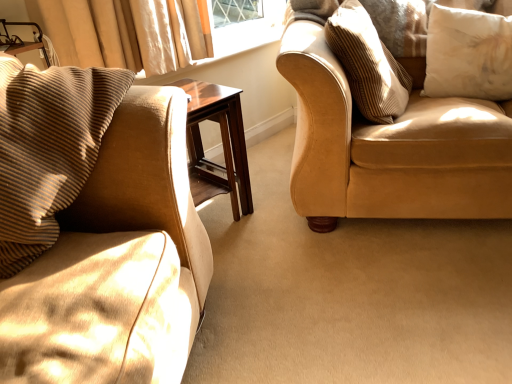
Question: Is striped fabric pillow at upper right, acting as the 2th pillow starting from the right, taller than white soft cushion at upper right, the first pillow from the right?

Choices:
 (A) yes
 (B) no

Answer: (A)

Question: Is striped fabric pillow at upper right, acting as the 2th pillow starting from the right, facing towards white soft cushion at upper right, the first pillow from the right?

Choices:
 (A) yes
 (B) no

Answer: (A)

Question: Does striped fabric pillow at upper right, acting as the 2th pillow starting from the right, appear on the left side of white soft cushion at upper right, which ranks as the third pillow in left-to-right order?

Choices:
 (A) yes
 (B) no

Answer: (A)

Question: From a real-world perspective, is striped fabric pillow at upper right, acting as the 2th pillow starting from the right, located beneath white soft cushion at upper right, the first pillow from the right?

Choices:
 (A) no
 (B) yes

Answer: (A)

Question: Is striped fabric pillow at upper right, acting as the 2th pillow starting from the right, beside white soft cushion at upper right, the first pillow from the right?

Choices:
 (A) no
 (B) yes

Answer: (A)

Question: Based on their sizes in the image, would you say white soft cushion at upper right, the first pillow from the right, is bigger or smaller than brown corduroy pillow at left, positioned as the third pillow in right-to-left order?

Choices:
 (A) big
 (B) small

Answer: (B)

Question: Would you say white soft cushion at upper right, the first pillow from the right, is inside or outside brown corduroy pillow at left, which is the 1th pillow from left to right?

Choices:
 (A) outside
 (B) inside

Answer: (A)

Question: Is white soft cushion at upper right, which ranks as the third pillow in left-to-right order, taller or shorter than brown corduroy pillow at left, which is the 1th pillow from left to right?

Choices:
 (A) tall
 (B) short

Answer: (B)

Question: Is point (473, 64) positioned closer to the camera than point (9, 238)?

Choices:
 (A) closer
 (B) farther

Answer: (B)

Question: From a real-world perspective, is brown corduroy pillow at left, positioned as the third pillow in right-to-left order, physically located above or below mahogany wood side table at center?

Choices:
 (A) below
 (B) above

Answer: (B)

Question: Is point (17, 155) positioned closer to the camera than point (233, 218)?

Choices:
 (A) farther
 (B) closer

Answer: (B)

Question: Considering the positions of brown corduroy pillow at left, positioned as the third pillow in right-to-left order, and mahogany wood side table at center in the image, is brown corduroy pillow at left, positioned as the third pillow in right-to-left order, taller or shorter than mahogany wood side table at center?

Choices:
 (A) tall
 (B) short

Answer: (B)

Question: Would you say brown corduroy pillow at left, positioned as the third pillow in right-to-left order, is to the left or to the right of mahogany wood side table at center in the picture?

Choices:
 (A) right
 (B) left

Answer: (B)

Question: Considering the positions of white soft cushion at upper right, the first pillow from the right, and suede beige couch at right in the image, is white soft cushion at upper right, the first pillow from the right, wider or thinner than suede beige couch at right?

Choices:
 (A) thin
 (B) wide

Answer: (A)

Question: In terms of height, does white soft cushion at upper right, the first pillow from the right, look taller or shorter compared to suede beige couch at right?

Choices:
 (A) tall
 (B) short

Answer: (B)